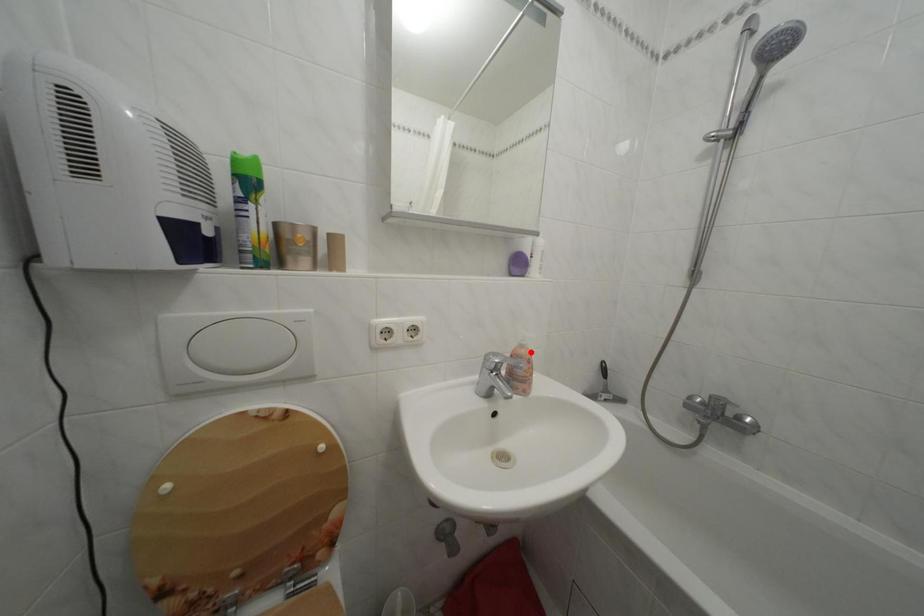
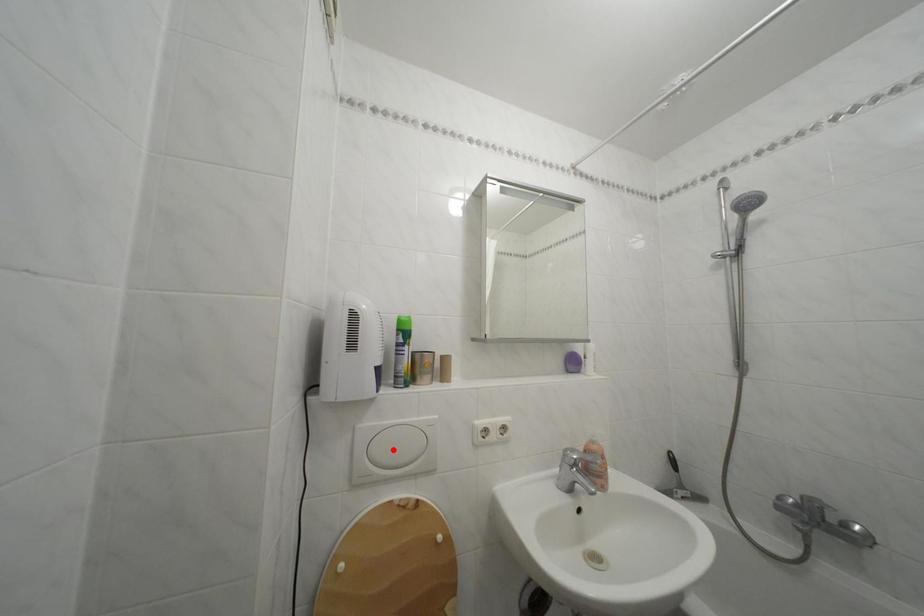
I am providing you with two images of the same scene from different viewpoints. A red point is marked on the first image and another point is marked on the second image. Does the point marked in image1 correspond to the same location as the one in image2?

No